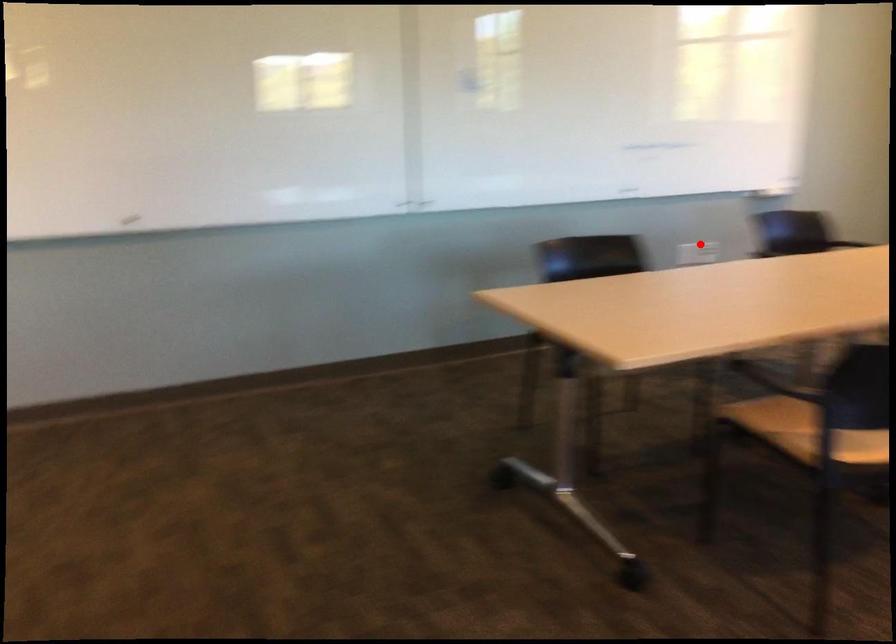
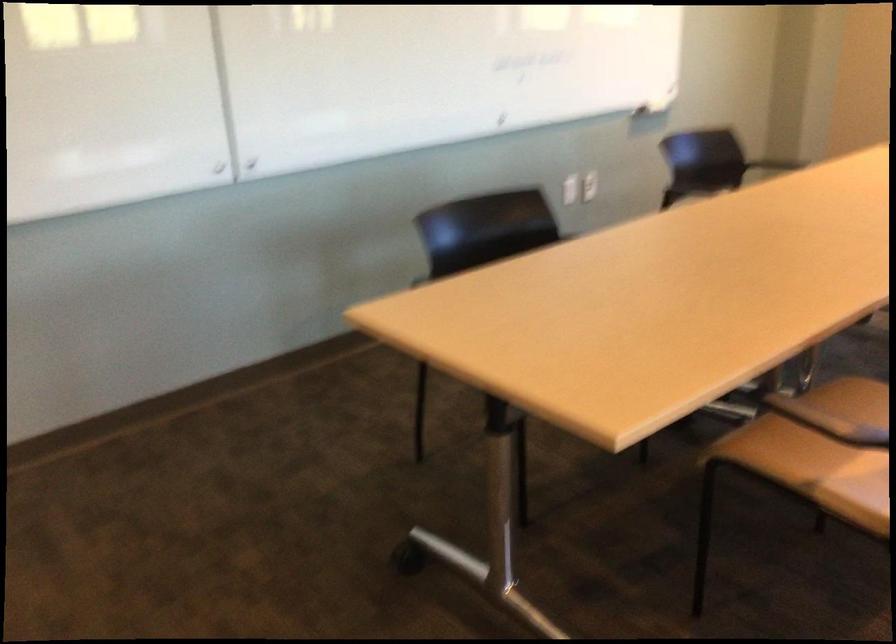
Question: I am providing you with two images of the same scene from different viewpoints. In image1, a red point is highlighted. Considering the same 3D point in image2, which of the following is correct?

Choices:
 (A) It is closer
 (B) It is farther

Answer: (A)